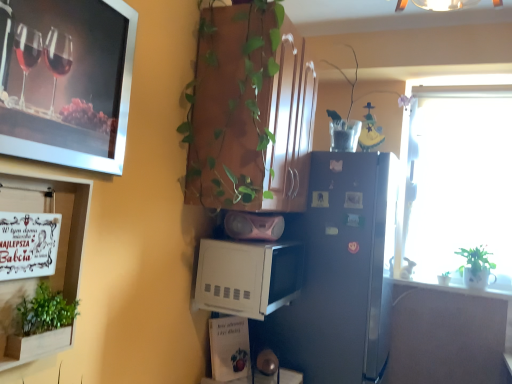
Question: Is translucent plastic vase at upper center, which is the 2th houseplant from front to back, not within green leafy plant at lower left, arranged as the third houseplant when viewed from the back?

Choices:
 (A) no
 (B) yes

Answer: (B)

Question: Is translucent plastic vase at upper center, the 3th houseplant positioned from the bottom, at the left side of green leafy plant at lower left, which appears as the 1th houseplant when viewed from the front?

Choices:
 (A) yes
 (B) no

Answer: (B)

Question: Does translucent plastic vase at upper center, the second houseplant positioned from the back, have a lesser height compared to green leafy plant at lower left, the second houseplant when ordered from bottom to top?

Choices:
 (A) no
 (B) yes

Answer: (A)

Question: From the image's perspective, is translucent plastic vase at upper center, the 3th houseplant positioned from the bottom, below green leafy plant at lower left, the first houseplant viewed from the left?

Choices:
 (A) yes
 (B) no

Answer: (B)

Question: Does translucent plastic vase at upper center, which is the 2th houseplant from front to back, have a larger size compared to green leafy plant at lower left, marked as the third houseplant in a right-to-left arrangement?

Choices:
 (A) yes
 (B) no

Answer: (A)

Question: From the image's perspective, relative to white glossy counter top at right, is pink matte speaker at center, positioned as the 2th appliance in bottom-to-top order, above or below?

Choices:
 (A) below
 (B) above

Answer: (B)

Question: Is point (237, 225) positioned closer to the camera than point (503, 284)?

Choices:
 (A) closer
 (B) farther

Answer: (A)

Question: In terms of size, does pink matte speaker at center, placed as the 1th appliance when sorted from top to bottom, appear bigger or smaller than white glossy counter top at right?

Choices:
 (A) big
 (B) small

Answer: (A)

Question: Based on their positions, is pink matte speaker at center, placed as the 1th appliance when sorted from top to bottom, located to the left or right of white glossy counter top at right?

Choices:
 (A) right
 (B) left

Answer: (B)

Question: From the image's perspective, is pink matte speaker at center, positioned as the 2th appliance in bottom-to-top order, positioned above or below translucent plastic vase at upper center, which ranks as the first houseplant in top-to-bottom order?

Choices:
 (A) below
 (B) above

Answer: (A)

Question: Looking at their shapes, would you say pink matte speaker at center, placed as the 1th appliance when sorted from top to bottom, is wider or thinner than translucent plastic vase at upper center, the second houseplant viewed from the left?

Choices:
 (A) wide
 (B) thin

Answer: (B)

Question: Is point (228, 233) positioned closer to the camera than point (350, 89)?

Choices:
 (A) closer
 (B) farther

Answer: (A)

Question: In terms of size, does pink matte speaker at center, placed as the 1th appliance when sorted from top to bottom, appear bigger or smaller than translucent plastic vase at upper center, which is the 2th houseplant from front to back?

Choices:
 (A) big
 (B) small

Answer: (B)

Question: Looking at the image, does white glossy counter top at right seem bigger or smaller compared to green leafy plant at lower left, the second houseplant when ordered from bottom to top?

Choices:
 (A) small
 (B) big

Answer: (B)

Question: Considering the positions of white glossy counter top at right and green leafy plant at lower left, which appears as the 1th houseplant when viewed from the front, in the image, is white glossy counter top at right wider or thinner than green leafy plant at lower left, which appears as the 1th houseplant when viewed from the front,?

Choices:
 (A) thin
 (B) wide

Answer: (B)